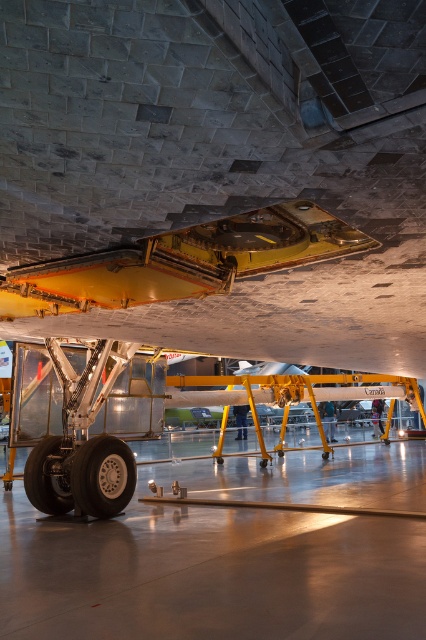
Question: Among these objects, which one is nearest to the camera?

Choices:
 (A) shiny black tire at lower left
 (B) shiny silver tire at lower left

Answer: (B)

Question: Is concrete tarmac at center positioned before metallic yellow wing at center?

Choices:
 (A) yes
 (B) no

Answer: (A)

Question: Is concrete tarmac at center further to camera compared to shiny silver tire at lower left?

Choices:
 (A) no
 (B) yes

Answer: (A)

Question: Can you confirm if metallic yellow wing at center is positioned above shiny black tire at lower left?

Choices:
 (A) no
 (B) yes

Answer: (B)

Question: Which point is closer to the camera taking this photo?

Choices:
 (A) (173, 592)
 (B) (45, 490)
 (C) (166, 262)

Answer: (C)

Question: Which point is farther from the camera taking this photo?

Choices:
 (A) (109, 468)
 (B) (58, 464)
 (C) (339, 488)
 (D) (210, 232)

Answer: (C)